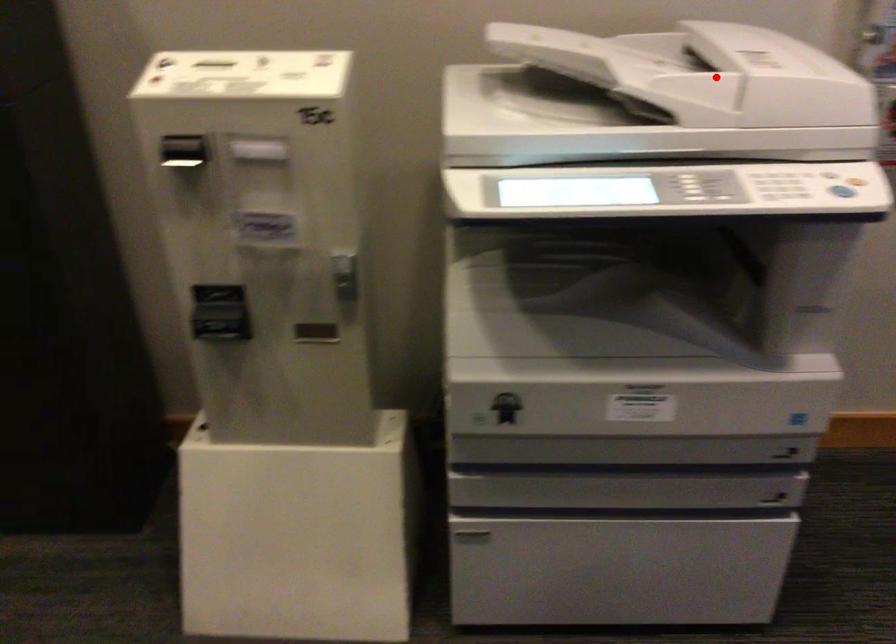
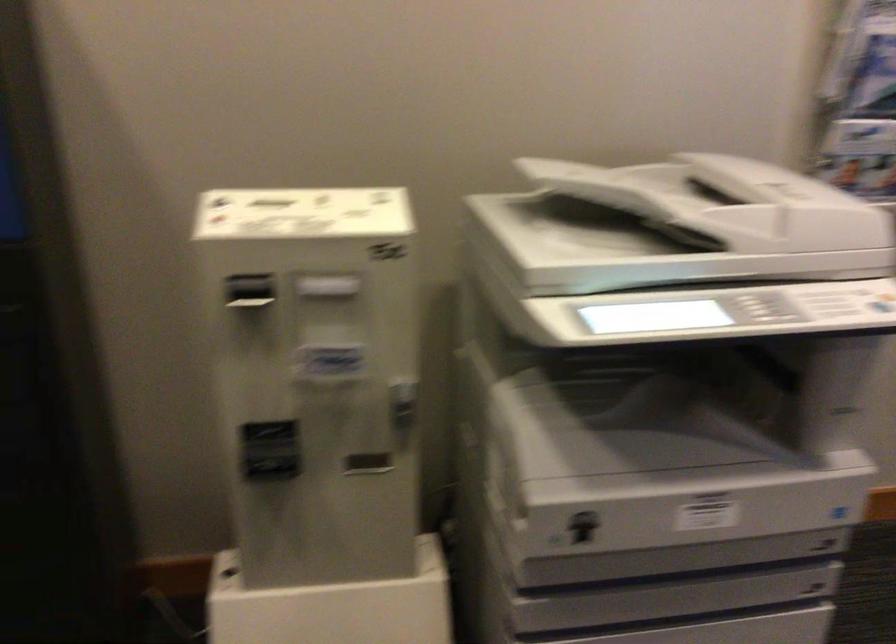
The point at the highlighted location is marked in the first image. Where is the corresponding point in the second image?

(724, 203)